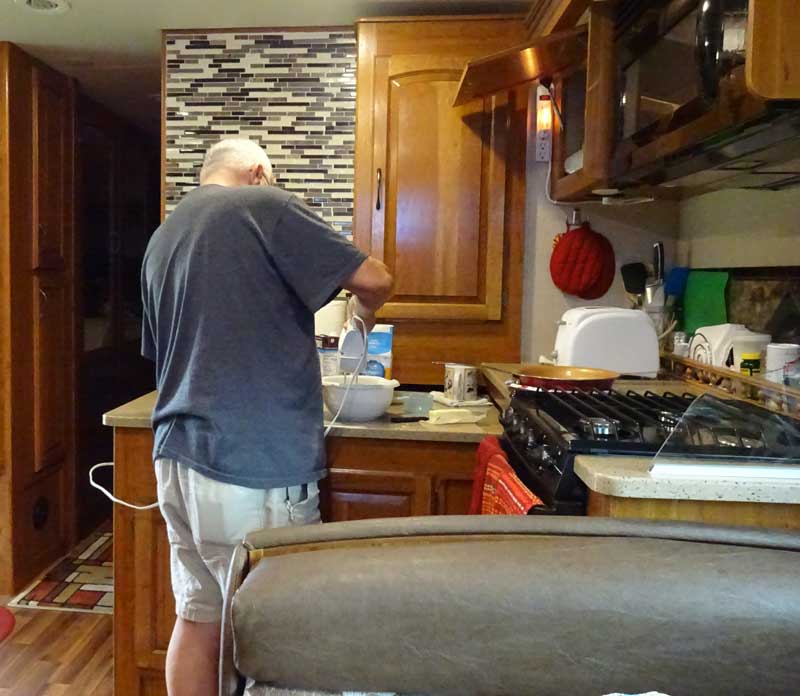
Identify the location of toaster. (597, 344).